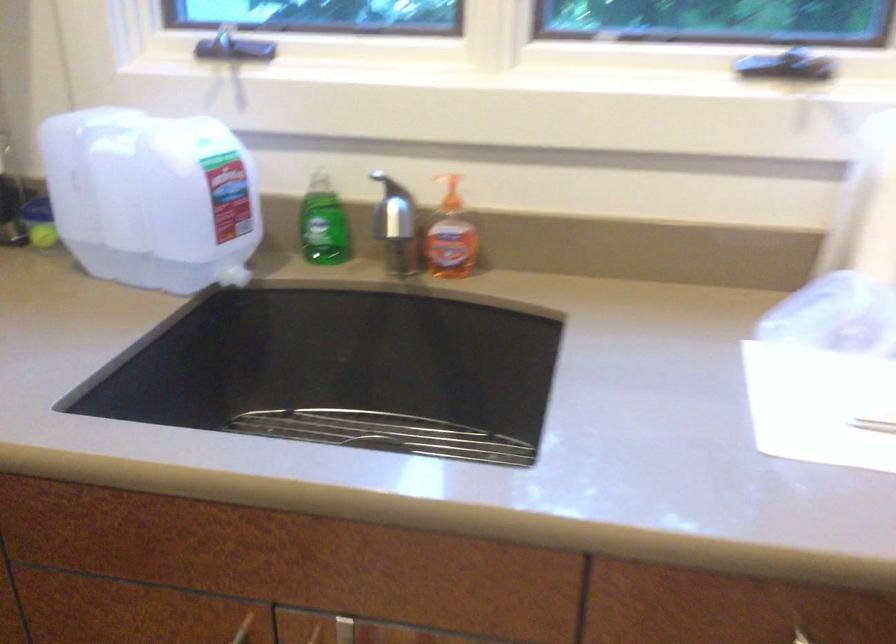
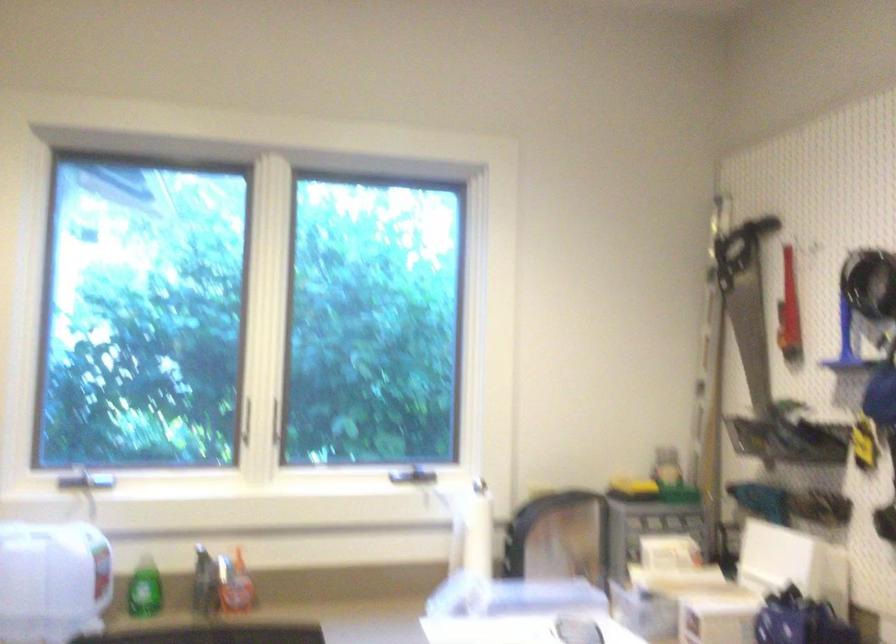
Where in the second image is the point corresponding to [317,228] from the first image?

(143, 589)